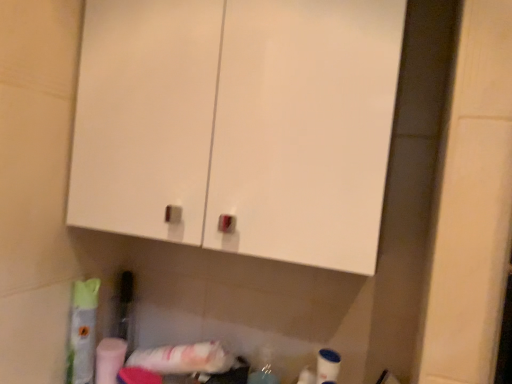
Describe the element at coordinates (238, 124) in the screenshot. I see `white glossy cabinet at upper center` at that location.

Where is `white glossy cabinet at upper center`? The image size is (512, 384). white glossy cabinet at upper center is located at coordinates (238, 124).

What is the approximate width of white glossy cabinet at upper center?

The width of white glossy cabinet at upper center is 10.51 inches.

Locate an element on the screen. The width and height of the screenshot is (512, 384). white matte toilet paper at lower left is located at coordinates (109, 359).

Describe the element at coordinates (109, 359) in the screenshot. The image size is (512, 384). I see `white matte toilet paper at lower left` at that location.

Where is `white glossy cabinet at upper center`? Image resolution: width=512 pixels, height=384 pixels. white glossy cabinet at upper center is located at coordinates (238, 124).

Between white glossy cabinet at upper center and white matte toilet paper at lower left, which one appears on the right side from the viewer's perspective?

Positioned to the right is white glossy cabinet at upper center.

Is the position of white glossy cabinet at upper center more distant than that of white matte toilet paper at lower left?

No, white glossy cabinet at upper center is in front of white matte toilet paper at lower left.

Which is less distant, (190, 105) or (116, 370)?

Point (190, 105).

From the image's perspective, which is above, white glossy cabinet at upper center or white matte toilet paper at lower left?

From the image's view, white glossy cabinet at upper center is above.

From a real-world perspective, which object stands above the other?

From a 3D spatial view, white glossy cabinet at upper center is above.

In terms of width, does white glossy cabinet at upper center look wider or thinner when compared to white matte toilet paper at lower left?

Clearly, white glossy cabinet at upper center has more width compared to white matte toilet paper at lower left.

Between white glossy cabinet at upper center and white matte toilet paper at lower left, which one has more height?

white glossy cabinet at upper center is taller.

Which of these two, white glossy cabinet at upper center or white matte toilet paper at lower left, is bigger?

With larger size is white glossy cabinet at upper center.

Is white glossy cabinet at upper center not inside white matte toilet paper at lower left?

Indeed, white glossy cabinet at upper center is completely outside white matte toilet paper at lower left.

Is white glossy cabinet at upper center placed right next to white matte toilet paper at lower left?

No, white glossy cabinet at upper center is not making contact with white matte toilet paper at lower left.

Is white glossy cabinet at upper center turned away from white matte toilet paper at lower left?

No, white glossy cabinet at upper center is not facing away from white matte toilet paper at lower left.

Find the location of a particular element. cabinetry above the white matte toilet paper at lower left (from a real-world perspective) is located at coordinates (238, 124).

Which object is positioned more to the right, white matte toilet paper at lower left or white glossy cabinet at upper center?

Positioned to the right is white glossy cabinet at upper center.

Is white matte toilet paper at lower left closer to the viewer compared to white glossy cabinet at upper center?

No.

Is point (111, 339) positioned behind point (95, 54)?

Yes, it is.

From the image's perspective, is white matte toilet paper at lower left beneath white glossy cabinet at upper center?

Indeed, from the image's perspective, white matte toilet paper at lower left is shown beneath white glossy cabinet at upper center.

From a real-world perspective, between white matte toilet paper at lower left and white glossy cabinet at upper center, who is vertically lower?

white matte toilet paper at lower left, from a real-world perspective.

Based on the photo, which of these two, white matte toilet paper at lower left or white glossy cabinet at upper center, is wider?

white glossy cabinet at upper center.

Considering the sizes of white matte toilet paper at lower left and white glossy cabinet at upper center in the image, is white matte toilet paper at lower left taller or shorter than white glossy cabinet at upper center?

white matte toilet paper at lower left is shorter than white glossy cabinet at upper center.

Considering the sizes of objects white matte toilet paper at lower left and white glossy cabinet at upper center in the image provided, who is smaller, white matte toilet paper at lower left or white glossy cabinet at upper center?

white matte toilet paper at lower left.

Would you say white matte toilet paper at lower left contains white glossy cabinet at upper center?

That's incorrect, white glossy cabinet at upper center is not inside white matte toilet paper at lower left.

Is white matte toilet paper at lower left not near white glossy cabinet at upper center?

No, white matte toilet paper at lower left is not far from white glossy cabinet at upper center.

Is white matte toilet paper at lower left positioned with its back to white glossy cabinet at upper center?

white matte toilet paper at lower left does not have its back to white glossy cabinet at upper center.

What's the angular difference between white matte toilet paper at lower left and white glossy cabinet at upper center's facing directions?

The angle between the facing direction of white matte toilet paper at lower left and the facing direction of white glossy cabinet at upper center is 2.49 degrees.

How much distance is there between white matte toilet paper at lower left and white glossy cabinet at upper center?

white matte toilet paper at lower left and white glossy cabinet at upper center are 22.94 inches apart.

Locate an element on the screen. The image size is (512, 384). cabinetry above the white matte toilet paper at lower left (from a real-world perspective) is located at coordinates (238, 124).

In order to click on cabinetry in front of the white matte toilet paper at lower left in this screenshot , I will do `click(238, 124)`.

Locate an element on the screen. Image resolution: width=512 pixels, height=384 pixels. toilet paper that is below the white glossy cabinet at upper center (from the image's perspective) is located at coordinates (109, 359).